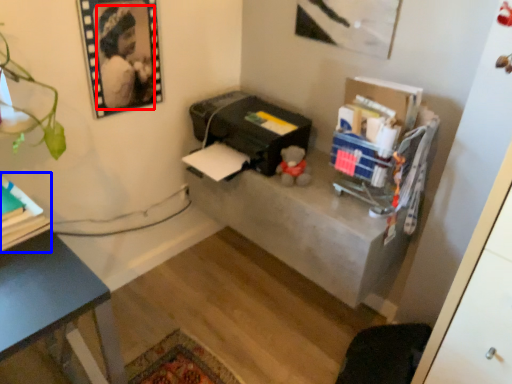
Question: Among these objects, which one is nearest to the camera, person (highlighted by a red box) or book (highlighted by a blue box)?

Choices:
 (A) person
 (B) book

Answer: (B)